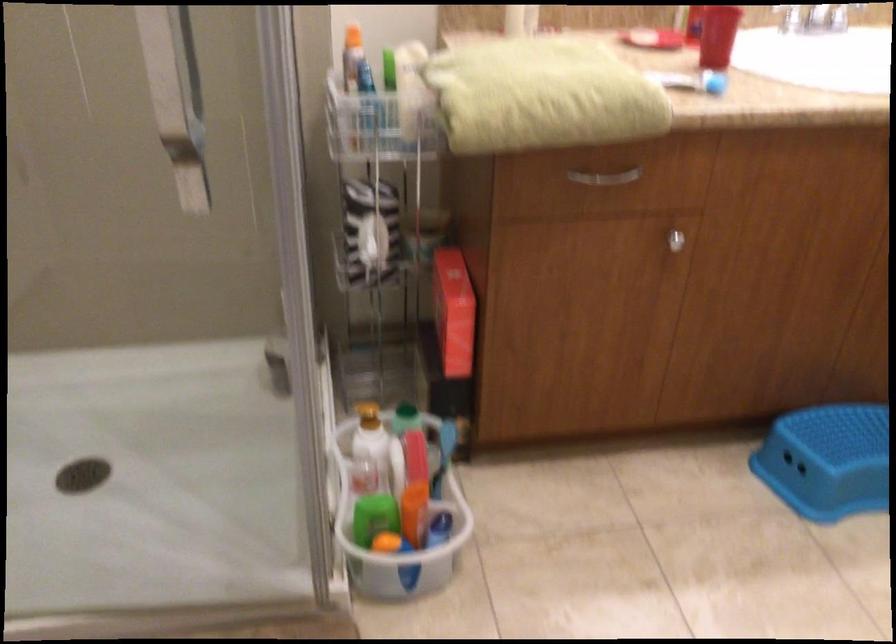
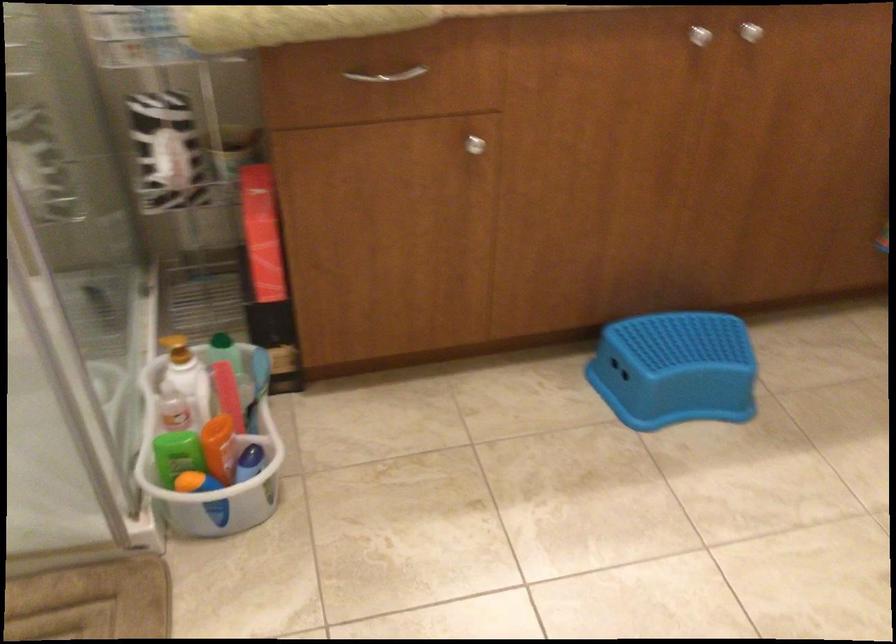
Locate, in the second image, the point that corresponds to point (407, 504) in the first image.

(208, 439)